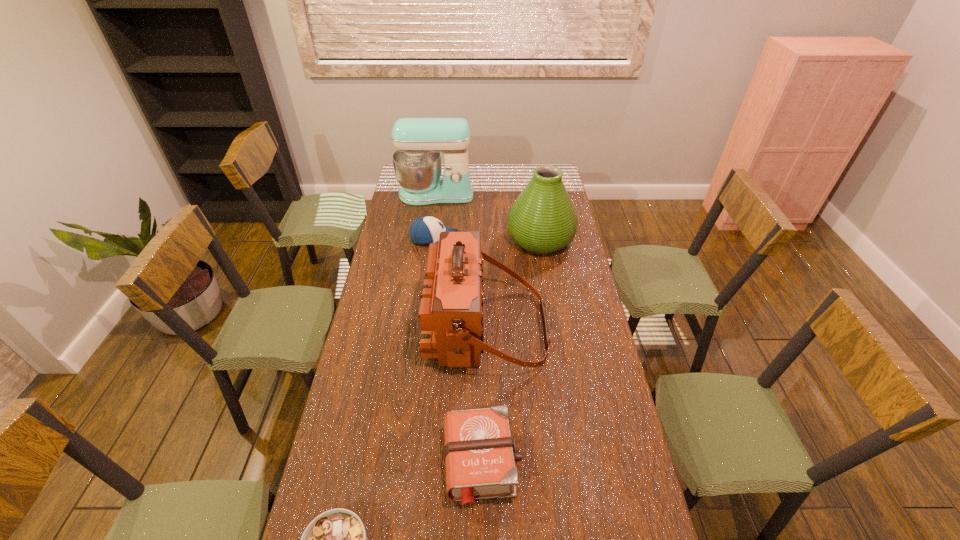
The width and height of the screenshot is (960, 540). What are the coordinates of `mixer` in the screenshot? It's located at (419, 142).

Where is `satchel`? This screenshot has width=960, height=540. satchel is located at coordinates (451, 314).

Locate an element on the screen. The height and width of the screenshot is (540, 960). vase is located at coordinates (542, 220).

Where is `the fourth tallest object`? Image resolution: width=960 pixels, height=540 pixels. the fourth tallest object is located at coordinates (425, 230).

Where is `the fifth farthest object`? the fifth farthest object is located at coordinates click(x=479, y=453).

You are a GUI agent. You are given a task and a screenshot of the screen. Output one action in this format:
    pyautogui.click(x=<x>, y=<y>)
    Task: Click on the vacant space located at the base of the mixer
    Image resolution: width=960 pixels, height=540 pixels.
    Given the screenshot: What is the action you would take?
    pyautogui.click(x=433, y=214)

You are a GUI agent. You are given a task and a screenshot of the screen. Output one action in this format:
    pyautogui.click(x=<x>, y=<y>)
    Task: Click on the vacant area situated on the face side of the third nearest object
    
    Given the screenshot: What is the action you would take?
    pyautogui.click(x=403, y=327)

Find the location of `vacant region located 0.210m on the face side of the third nearest object`. vacant region located 0.210m on the face side of the third nearest object is located at coordinates (369, 327).

Locate an element on the screen. This screenshot has height=540, width=960. free region located 0.120m on the face side of the third nearest object is located at coordinates (393, 327).

Identify the location of vacant area situated on the back of the vase. (534, 201).